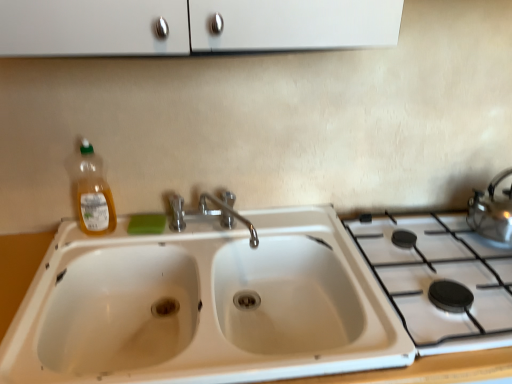
This screenshot has height=384, width=512. Identify the location of free space to the right of green matte soap at center. (201, 235).